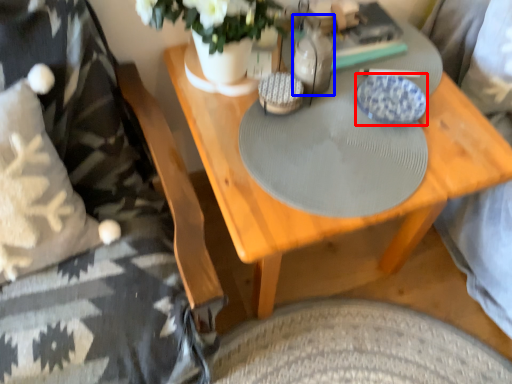
Question: Which point is closer to the camera, plate (highlighted by a red box) or bottle (highlighted by a blue box)?

Choices:
 (A) plate
 (B) bottle

Answer: (B)